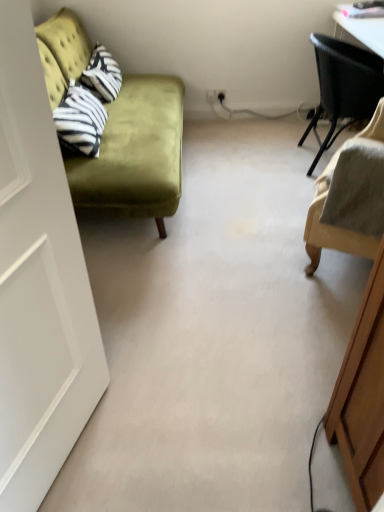
Question: Is black woven chair at upper right, the 1th chair from the top, surrounding velvet green couch at left?

Choices:
 (A) no
 (B) yes

Answer: (A)

Question: Considering the relative sizes of black woven chair at upper right, arranged as the second chair when ordered from the bottom, and velvet green couch at left in the image provided, is black woven chair at upper right, arranged as the second chair when ordered from the bottom, taller than velvet green couch at left?

Choices:
 (A) no
 (B) yes

Answer: (A)

Question: Is black woven chair at upper right, the 1th chair from the top, positioned beyond the bounds of velvet green couch at left?

Choices:
 (A) no
 (B) yes

Answer: (B)

Question: From a real-world perspective, is black woven chair at upper right, the 1th chair from the top, located higher than velvet green couch at left?

Choices:
 (A) yes
 (B) no

Answer: (B)

Question: From the image's perspective, does black woven chair at upper right, acting as the 2th chair starting from the front, appear lower than velvet green couch at left?

Choices:
 (A) yes
 (B) no

Answer: (B)

Question: From the image's perspective, is black woven chair at upper right, arranged as the second chair when ordered from the bottom, on top of velvet green couch at left?

Choices:
 (A) yes
 (B) no

Answer: (A)

Question: Is velvet green couch at left smaller than white matte door at left?

Choices:
 (A) no
 (B) yes

Answer: (A)

Question: Is the position of velvet green couch at left more distant than that of white matte door at left?

Choices:
 (A) yes
 (B) no

Answer: (A)

Question: From a real-world perspective, is velvet green couch at left physically above white matte door at left?

Choices:
 (A) yes
 (B) no

Answer: (B)

Question: Is velvet green couch at left beside white matte door at left?

Choices:
 (A) no
 (B) yes

Answer: (A)

Question: Is velvet green couch at left surrounding white matte door at left?

Choices:
 (A) yes
 (B) no

Answer: (B)

Question: Considering the relative sizes of velvet green couch at left and white matte door at left in the image provided, is velvet green couch at left wider than white matte door at left?

Choices:
 (A) yes
 (B) no

Answer: (A)

Question: Is beige fabric chair at right, the first chair in the bottom-to-top sequence, smaller than white matte door at left?

Choices:
 (A) yes
 (B) no

Answer: (B)